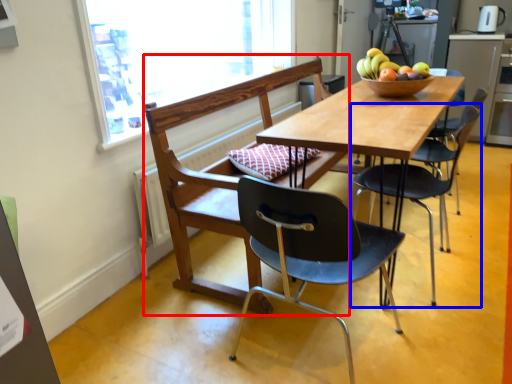
Question: Which of the following is the closest to the observer, chair (highlighted by a red box) or chair (highlighted by a blue box)?

Choices:
 (A) chair
 (B) chair

Answer: (A)